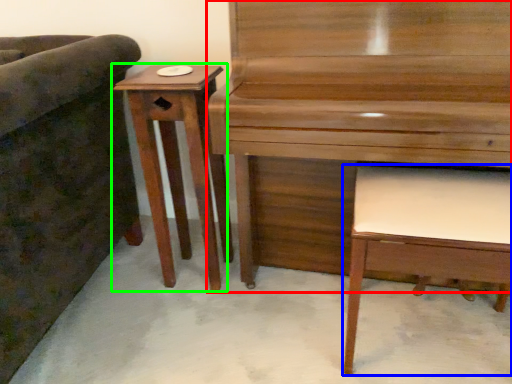
Question: Considering the real-world distances, which object is closest to piano (highlighted by a red box)? music stool (highlighted by a blue box) or table (highlighted by a green box).

Choices:
 (A) music stool
 (B) table

Answer: (A)